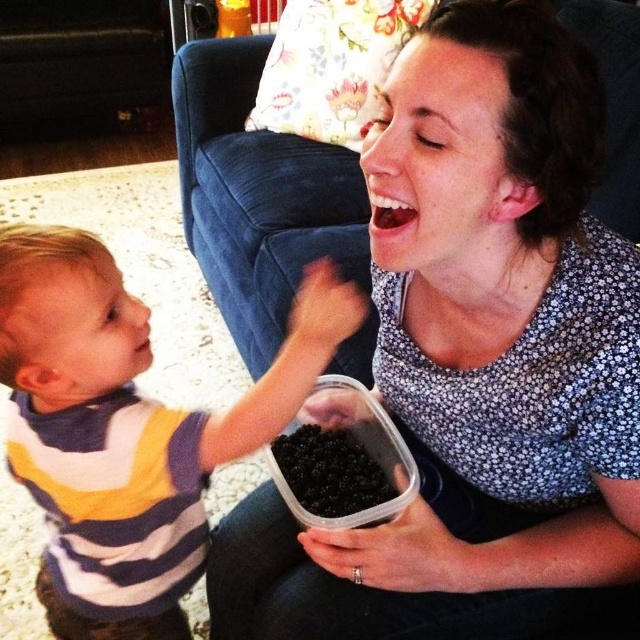
Can you confirm if floral-patterned shirt at center is positioned to the left of black matte container at center?

In fact, floral-patterned shirt at center is to the right of black matte container at center.

Is floral-patterned shirt at center below black matte container at center?

Incorrect, floral-patterned shirt at center is not positioned below black matte container at center.

At what (x,y) coordinates should I click in order to perform the action: click on floral-patterned shirt at center. Please return your answer as a coordinate pair (x, y). The height and width of the screenshot is (640, 640). Looking at the image, I should click on (476, 364).

Is floral-patterned shirt at center thinner than striped cotton shirt at left?

In fact, floral-patterned shirt at center might be wider than striped cotton shirt at left.

Does floral-patterned shirt at center have a lesser height compared to striped cotton shirt at left?

No, floral-patterned shirt at center is not shorter than striped cotton shirt at left.

Describe the element at coordinates (476, 364) in the screenshot. This screenshot has width=640, height=640. I see `floral-patterned shirt at center` at that location.

At what (x,y) coordinates should I click in order to perform the action: click on floral-patterned shirt at center. Please return your answer as a coordinate pair (x, y). The width and height of the screenshot is (640, 640). Looking at the image, I should click on (476, 364).

Between point (264, 406) and point (369, 492), which one is positioned in front?

Point (264, 406) is in front.

Who is lower down, striped cotton shirt at left or black matte container at center?

striped cotton shirt at left

In order to click on striped cotton shirt at left in this screenshot , I will do `click(129, 429)`.